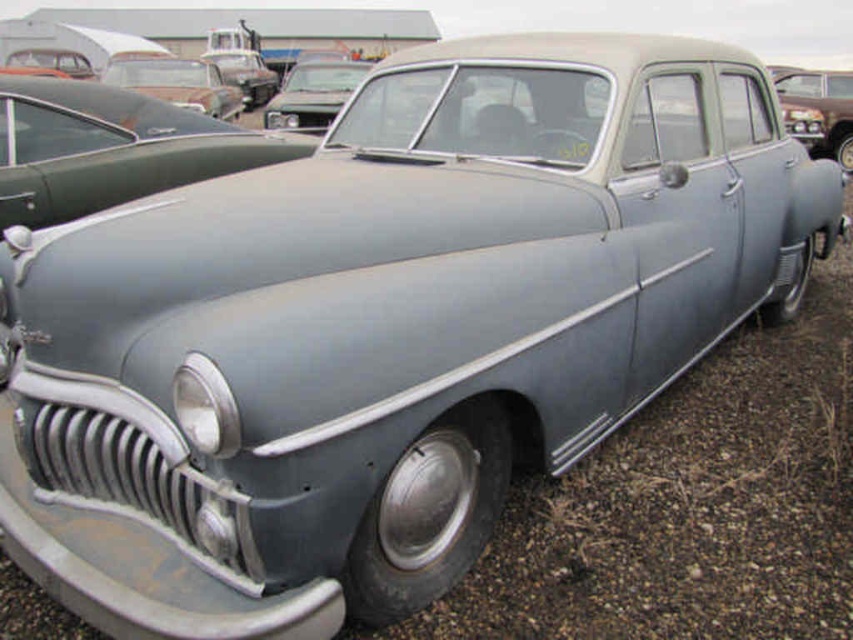
Question: Is matte gray car at upper right below rusty metal car at upper left?

Choices:
 (A) no
 (B) yes

Answer: (B)

Question: Which object is the closest to the matte gray car at center?

Choices:
 (A) rusty metal car at upper left
 (B) matte gray car at upper right

Answer: (A)

Question: Considering the real-world distances, which object is farthest from the rusty metal car at upper left?

Choices:
 (A) matte gray car at center
 (B) matte gray car at upper right

Answer: (B)

Question: Which of these objects is positioned farthest from the matte gray car at upper right?

Choices:
 (A) rusty metal car at upper left
 (B) matte gray car at center

Answer: (B)

Question: Does matte gray car at center appear over matte gray car at upper right?

Choices:
 (A) no
 (B) yes

Answer: (A)

Question: Does matte gray car at center have a smaller size compared to matte gray car at upper right?

Choices:
 (A) yes
 (B) no

Answer: (A)